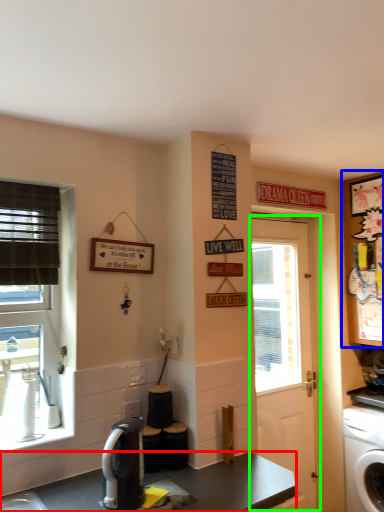
Question: Considering the real-world distances, which object is closest to desk (highlighted by a red box)? cabinetry (highlighted by a blue box) or door (highlighted by a green box).

Choices:
 (A) cabinetry
 (B) door

Answer: (B)